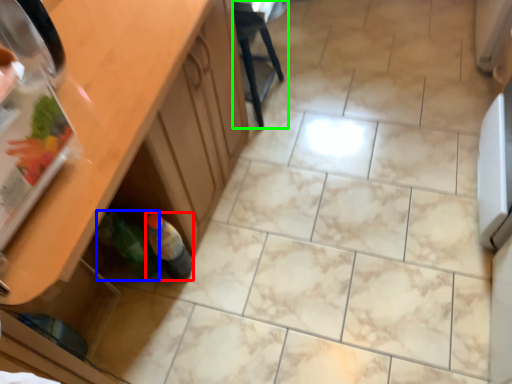
Question: Which object is the closest to the bottle (highlighted by a red box)? Choose among these: bottle (highlighted by a blue box) or chair (highlighted by a green box).

Choices:
 (A) bottle
 (B) chair

Answer: (A)